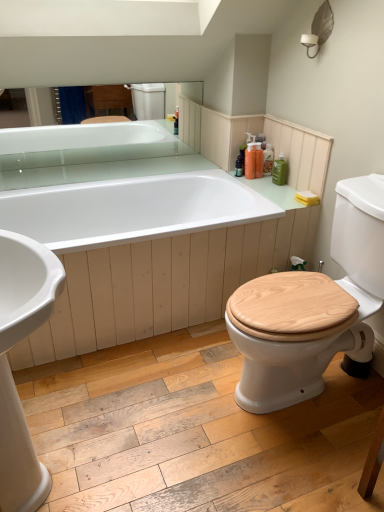
Question: Does point (91, 259) appear closer or farther from the camera than point (273, 152)?

Choices:
 (A) farther
 (B) closer

Answer: (B)

Question: Considering their positions, is white glossy bathtub at center located in front of or behind translucent plastic bottles at upper right, the second toiletry in the right-to-left sequence?

Choices:
 (A) behind
 (B) front

Answer: (B)

Question: Estimate the real-world distances between objects in this image. Which object is farther from the green matte bottle at upper right, the 3th toiletry in the left-to-right sequence?

Choices:
 (A) white glossy bathtub at center
 (B) translucent plastic bottles at upper right, the second toiletry in the right-to-left sequence
 (C) translucent orange bottle at upper right, the third toiletry from the right
 (D) wooden at right
 (E) yellow sponge at upper right

Answer: (D)

Question: Which is nearer to the translucent orange bottle at upper right, the third toiletry from the right?

Choices:
 (A) yellow sponge at upper right
 (B) white glossy bathtub at center
 (C) wooden at right
 (D) translucent plastic bottles at upper right, the second toiletry in the right-to-left sequence
 (E) green matte bottle at upper right, the 3th toiletry in the left-to-right sequence

Answer: (D)